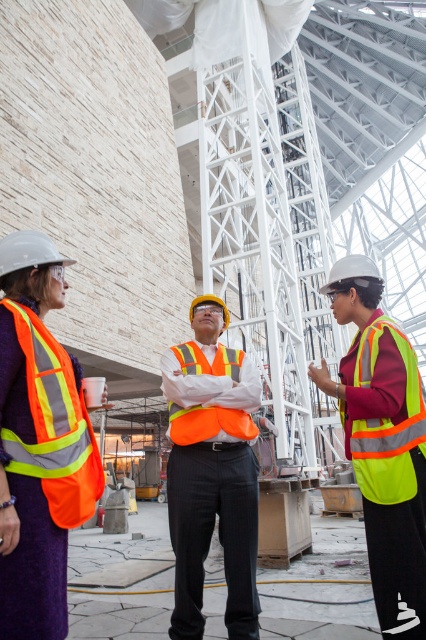
Question: Which of these objects is positioned farthest from the orange reflective vest at center?

Choices:
 (A) high-visibility orange safety vest at center
 (B) orange reflective vest at left
 (C) high-visibility reflective vest at center

Answer: (B)

Question: Where is orange reflective vest at left located in relation to high-visibility orange safety vest at center in the image?

Choices:
 (A) left
 (B) right

Answer: (A)

Question: Which object is farther from the camera taking this photo?

Choices:
 (A) orange reflective vest at center
 (B) high-visibility reflective vest at center
 (C) high-visibility fabric safety vest at center-right

Answer: (A)

Question: Can you confirm if orange reflective vest at left is positioned to the left of orange reflective vest at center?

Choices:
 (A) yes
 (B) no

Answer: (A)

Question: Does orange reflective vest at center appear over high-visibility orange safety vest at center?

Choices:
 (A) no
 (B) yes

Answer: (A)

Question: Which point is farther to the camera?

Choices:
 (A) click(x=362, y=464)
 (B) click(x=236, y=452)
 (C) click(x=213, y=432)
 (D) click(x=23, y=369)

Answer: (B)